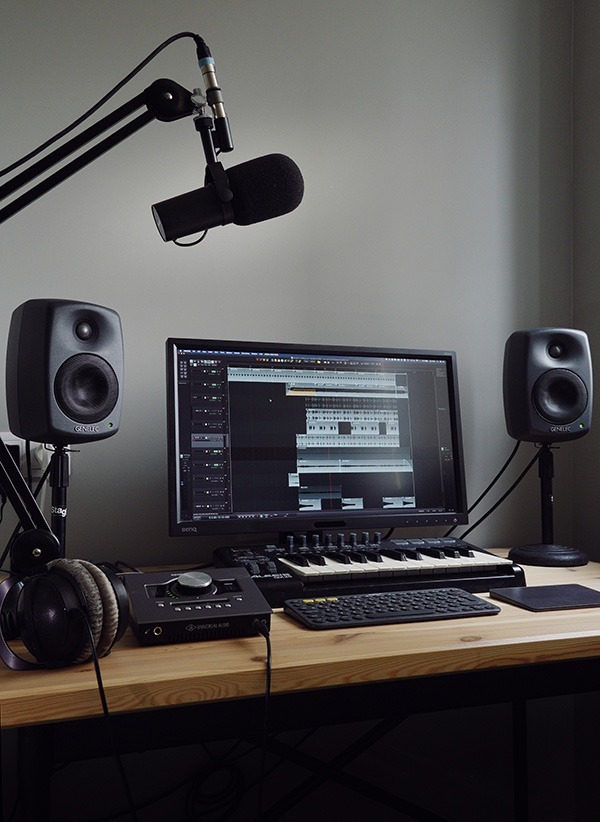
Find the location of a particular element. The width and height of the screenshot is (600, 822). mic is located at coordinates (277, 194).